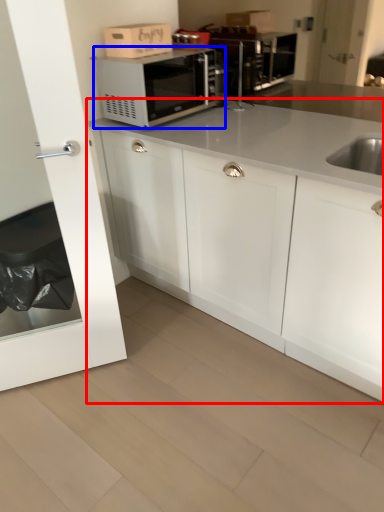
Question: Which point is further to the camera, cabinetry (highlighted by a red box) or microwave oven (highlighted by a blue box)?

Choices:
 (A) cabinetry
 (B) microwave oven

Answer: (B)